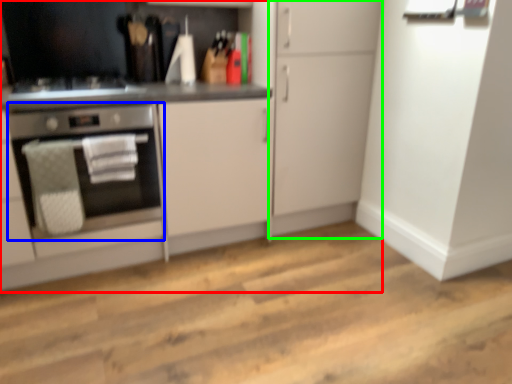
Question: Based on their relative distances, which object is farther from cabinetry (highlighted by a red box)? Choose from home appliance (highlighted by a blue box) and cabinetry (highlighted by a green box).

Choices:
 (A) home appliance
 (B) cabinetry

Answer: (A)